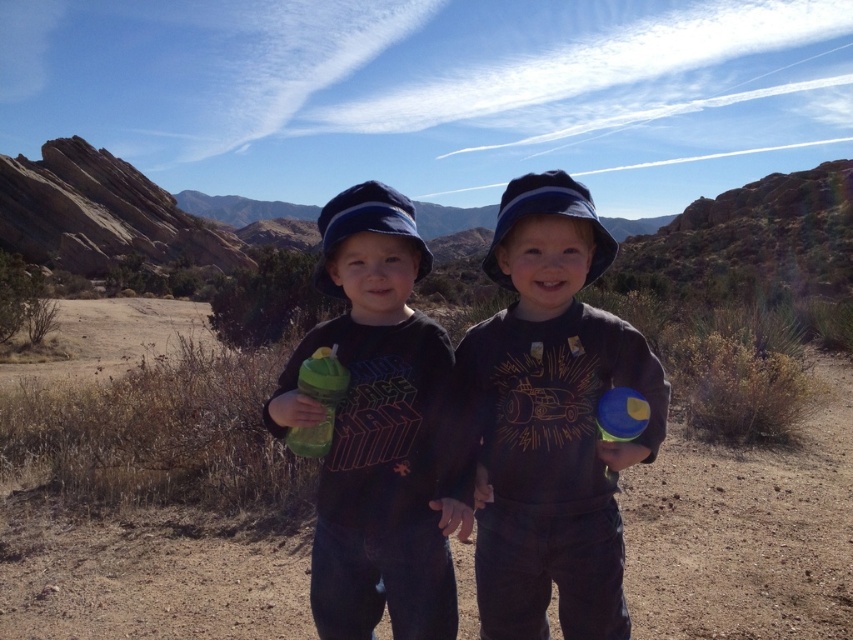
You are a photographer setting up for a photo shoot. You need to position two models wearing the dark gray cotton shirt at center and the matte black shirt at center so that there is exactly 24 inches between them. Based on the current setup shown in the image, should you move the models closer together or farther apart to achieve the desired distance?

The dark gray cotton shirt at center is currently 26.42 inches from the matte black shirt at center. To reduce the distance to 24 inches, you should move the models closer together by approximately 2.42 inches.

You are a photographer trying to adjust the lighting for a photo shoot. You notice two shirts in the scene, the dark gray cotton shirt at center and the matte black shirt at center. Which shirt is covering part of the other shirt?

The dark gray cotton shirt at center is positioned over the matte black shirt at center, so it is covering part of the matte black shirt at center.

You are a photographer trying to capture a clear shot of the dark gray cotton shirt at center. Based on the scene description, where should you position your camera relative to the children to ensure the shirt is in focus?

The dark gray cotton shirt at center is located at point (552, 420), so position your camera directly facing the center of the children to ensure the shirt is in focus.